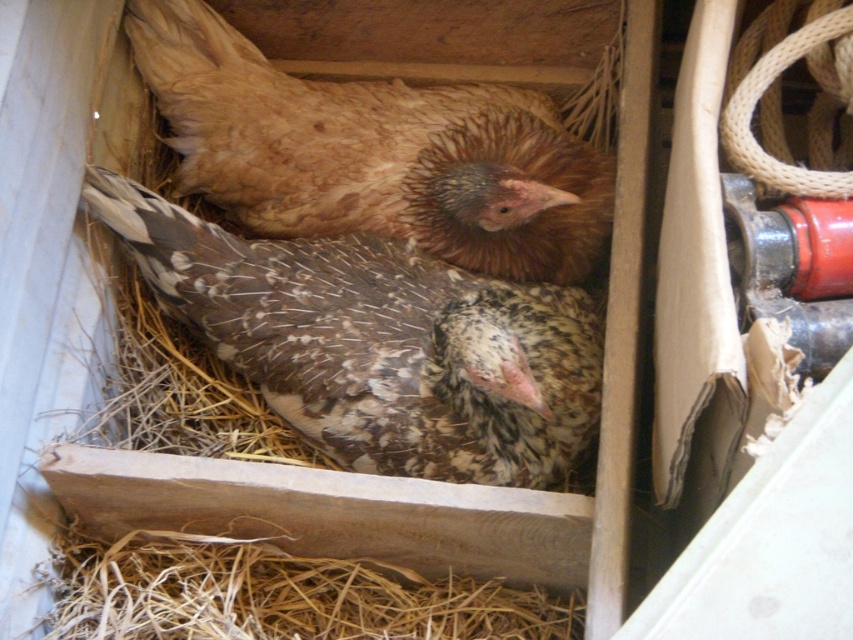
Question: Does speckled feathered chicken at center appear over brown speckled chicken at upper center?

Choices:
 (A) yes
 (B) no

Answer: (B)

Question: Is speckled feathered chicken at center bigger than brown speckled chicken at upper center?

Choices:
 (A) yes
 (B) no

Answer: (A)

Question: Which point is closer to the camera taking this photo?

Choices:
 (A) (143, 253)
 (B) (155, 29)

Answer: (A)

Question: Which of the following is the farthest from the observer?

Choices:
 (A) speckled feathered chicken at center
 (B) brown speckled chicken at upper center

Answer: (B)

Question: Is speckled feathered chicken at center wider than brown speckled chicken at upper center?

Choices:
 (A) yes
 (B) no

Answer: (A)